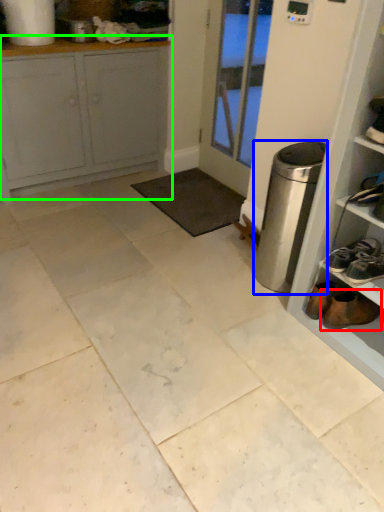
Question: Based on their relative distances, which object is nearer to footwear (highlighted by a red box)? Choose from appliance (highlighted by a blue box) and cabinetry (highlighted by a green box).

Choices:
 (A) appliance
 (B) cabinetry

Answer: (A)